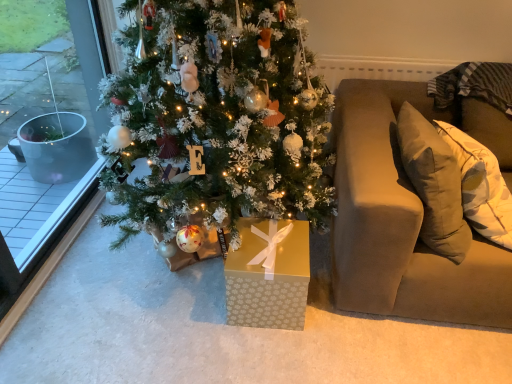
At what (x,y) coordinates should I click in order to perform the action: click on free spot above gold paper gift box at center (from a real-world perspective). Please return your answer as a coordinate pair (x, y). This screenshot has width=512, height=384. Looking at the image, I should click on (269, 241).